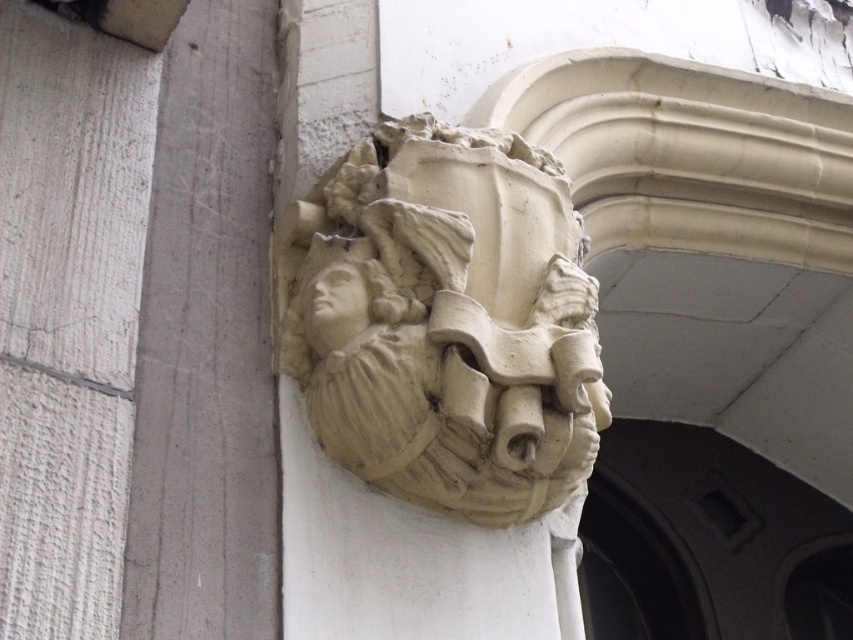
Question: Is beige stone sculpture at center positioned at the back of matte stone head at center?

Choices:
 (A) no
 (B) yes

Answer: (A)

Question: Which object appears farthest from the camera in this image?

Choices:
 (A) white stone carving at upper left
 (B) matte stone head at center

Answer: (B)

Question: Which of the following is the farthest from the observer?

Choices:
 (A) (368, 248)
 (B) (228, 320)
 (C) (315, 284)

Answer: (B)

Question: Can you confirm if white stone carving at upper left is positioned to the left of matte stone head at center?

Choices:
 (A) no
 (B) yes

Answer: (B)

Question: Which point is closer to the camera?

Choices:
 (A) matte stone face at center
 (B) beige stone sculpture at center

Answer: (B)

Question: Does beige stone sculpture at center lie behind matte stone face at center?

Choices:
 (A) no
 (B) yes

Answer: (A)